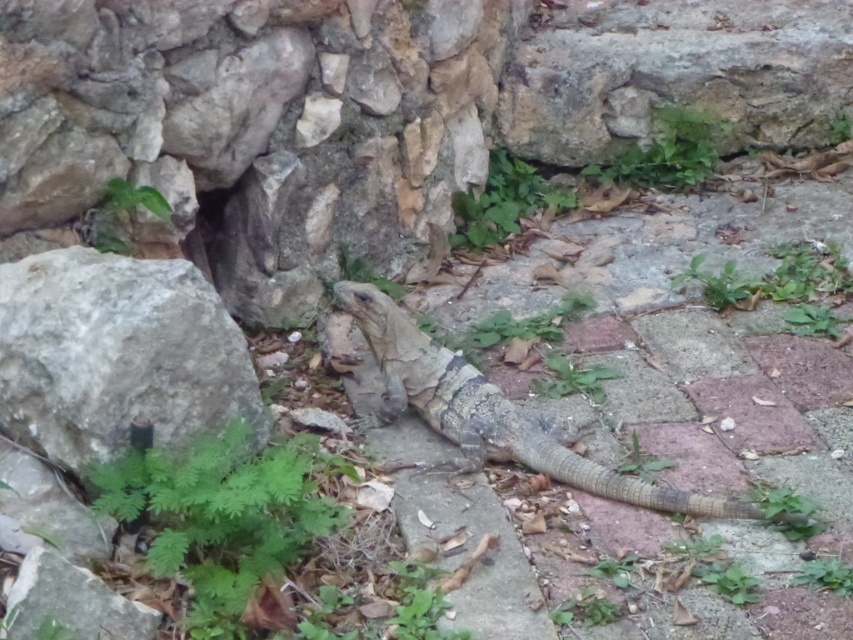
Question: Among these objects, which one is nearest to the camera?

Choices:
 (A) gray rough rock at left
 (B) leathery brown lizard at center
 (C) leathery brown iguana at center

Answer: (C)

Question: Among these objects, which one is farthest from the camera?

Choices:
 (A) gray rough rock at left
 (B) leathery brown iguana at center

Answer: (A)

Question: Does leathery brown iguana at center appear on the left side of leathery brown lizard at center?

Choices:
 (A) no
 (B) yes

Answer: (A)

Question: Is gray rough rock at left smaller than leathery brown lizard at center?

Choices:
 (A) no
 (B) yes

Answer: (B)

Question: Can you confirm if gray rough rock at left is positioned to the left of leathery brown lizard at center?

Choices:
 (A) yes
 (B) no

Answer: (A)

Question: Which object is closer to the camera taking this photo?

Choices:
 (A) gray rough rock at left
 (B) leathery brown lizard at center

Answer: (A)